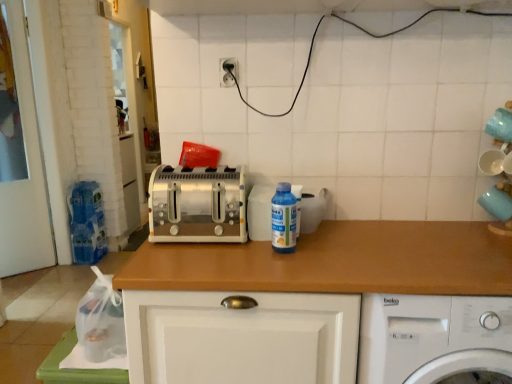
Locate an element on the screen. The image size is (512, 384). free space to the left of transparent plastic bottle at center is located at coordinates (231, 248).